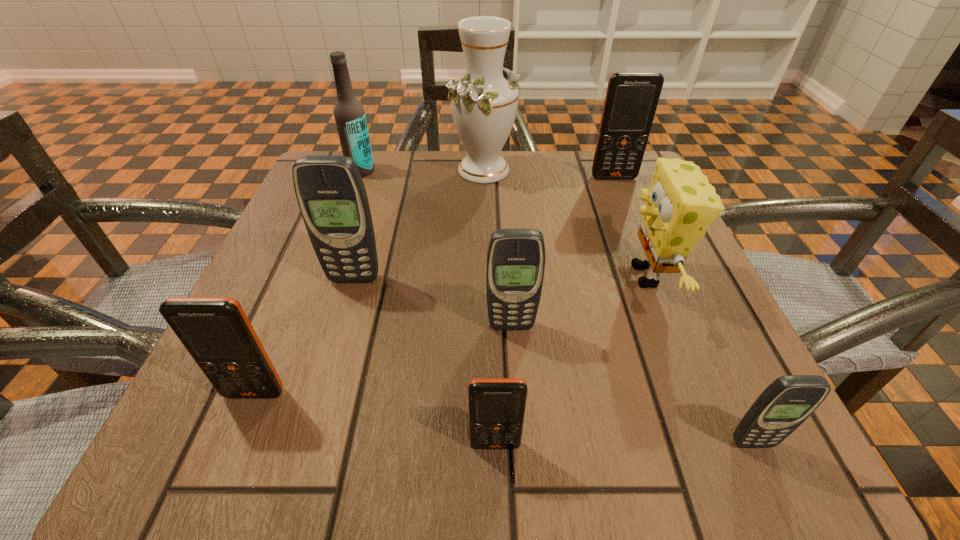
The width and height of the screenshot is (960, 540). Find the location of `object located in the far right corner section of the desktop`. object located in the far right corner section of the desktop is located at coordinates (631, 100).

Identify the location of object positioned at the near right corner. The height and width of the screenshot is (540, 960). (787, 402).

In the image, there is a desktop. At what (x,y) coordinates should I click in order to perform the action: click on vacant space at the far edge. Please return your answer as a coordinate pair (x, y). The width and height of the screenshot is (960, 540). Looking at the image, I should click on (549, 211).

Locate an element on the screen. The height and width of the screenshot is (540, 960). free location at the near edge of the desktop is located at coordinates (402, 418).

This screenshot has width=960, height=540. I want to click on vacant area at the near left corner of the desktop, so click(x=185, y=459).

Where is `vacant point at the far right corner`? Image resolution: width=960 pixels, height=540 pixels. vacant point at the far right corner is located at coordinates (580, 185).

Identify the location of free space between the second biggest gray cellular telephone and the beer bottle. (436, 248).

Locate an element on the screen. Image resolution: width=960 pixels, height=540 pixels. unoccupied area between the nearest orange cellular telephone and the farthest gray cellular telephone is located at coordinates (424, 362).

This screenshot has width=960, height=540. Find the location of `unoccupied position between the smallest orange cellular telephone and the beer bottle`. unoccupied position between the smallest orange cellular telephone and the beer bottle is located at coordinates (428, 307).

You are a GUI agent. You are given a task and a screenshot of the screen. Output one action in this format:
    pyautogui.click(x=<x>, y=<y>)
    Task: Click on the blank region between the second smallest gray cellular telephone and the yellow sponge
    
    Given the screenshot: What is the action you would take?
    pyautogui.click(x=579, y=301)